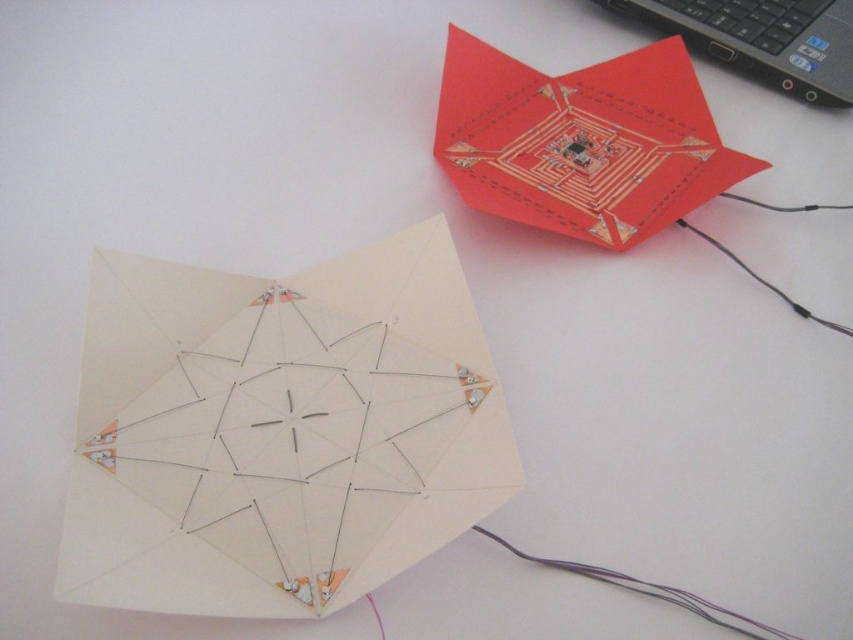
You are an engineer designing a display for an art exhibition. You need to place a small LED light on the tallest object in the scene. Which object should you choose between the white matte paper at center and the purple wire at lower right?

The white matte paper at center is much taller than the purple wire at lower right, so you should place the small LED light on the white matte paper at center.

You are an artist planning to place a new sculpture between the white matte paper at center and the purple wire at lower right. Considering their sizes, which object should you position closer to the center of the desk to maintain balance?

The white matte paper at center is wider than the purple wire at lower right, so positioning the sculpture closer to the white matte paper at center would help maintain balance by counteracting its larger size.

Based on the photo, you are an artist planning to place a new sculpture on the white surface where the white matte paper at center and the purple wire at lower right are already present. Which object should you move to make space for the sculpture, and why?

You should move the purple wire at lower right because the white matte paper at center is larger in size and might require more space to maintain its structural integrity or visual impact.